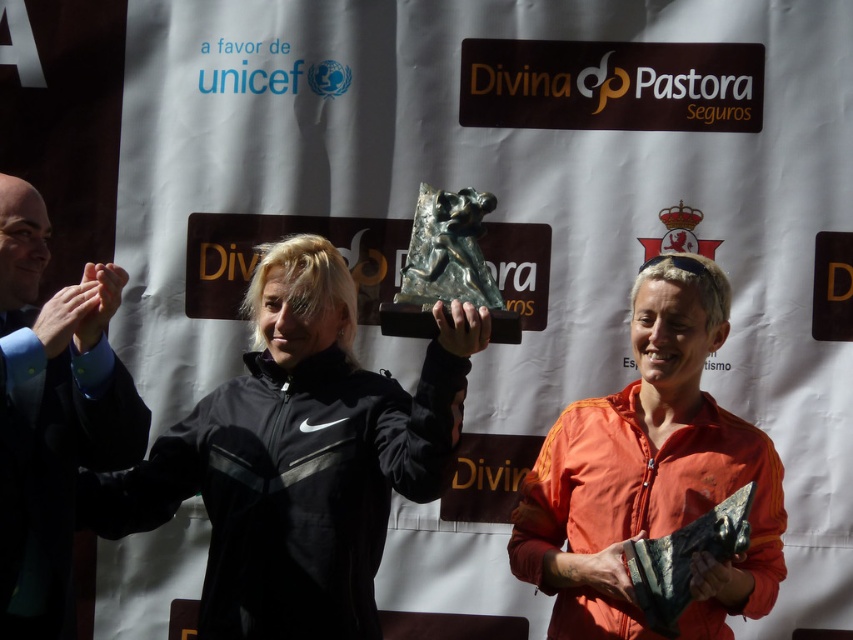
You are a photographer at the event. You need to adjust the camera focus so that both the orange matte jacket at center and the dark blue suit at left are in focus. Given that the depth of field can only cover a height difference of 1 meter, will you be able to achieve this?

The orange matte jacket at center is much taller than the dark blue suit at left. Since the height difference exceeds 1 meter, the depth of field may not be sufficient to keep both in focus. Adjust the camera settings or position to ensure both are within the desired range.

Looking at this image, you are a photographer standing at a distance. You want to take a closeup shot of the black matte jacket at center. Given that your camera has a maximum zoom range of 50 feet, will you be able to capture the jacket clearly without moving closer?

The black matte jacket at center is 42.86 feet away from the camera. Since the camera can zoom up to 50 feet, you can capture the jacket clearly without moving closer.